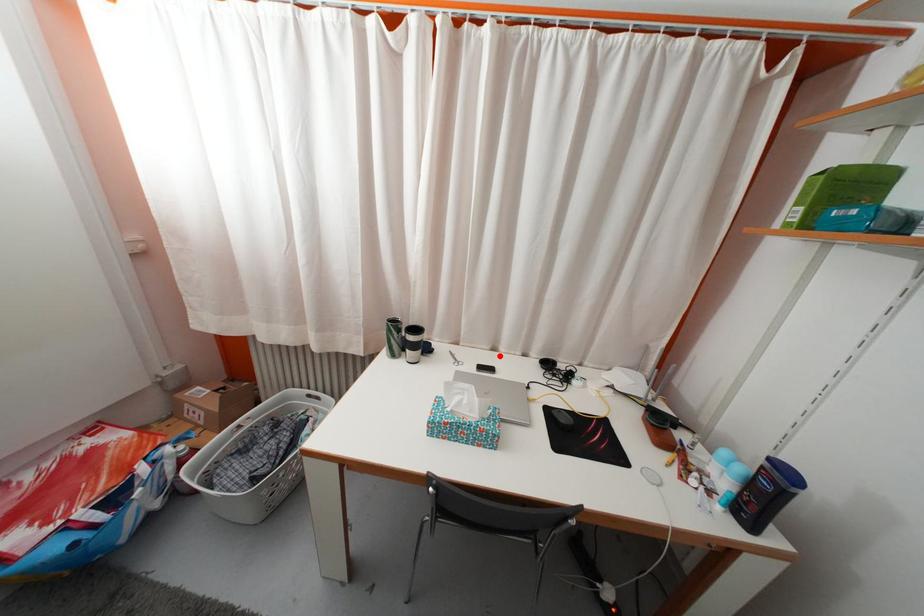
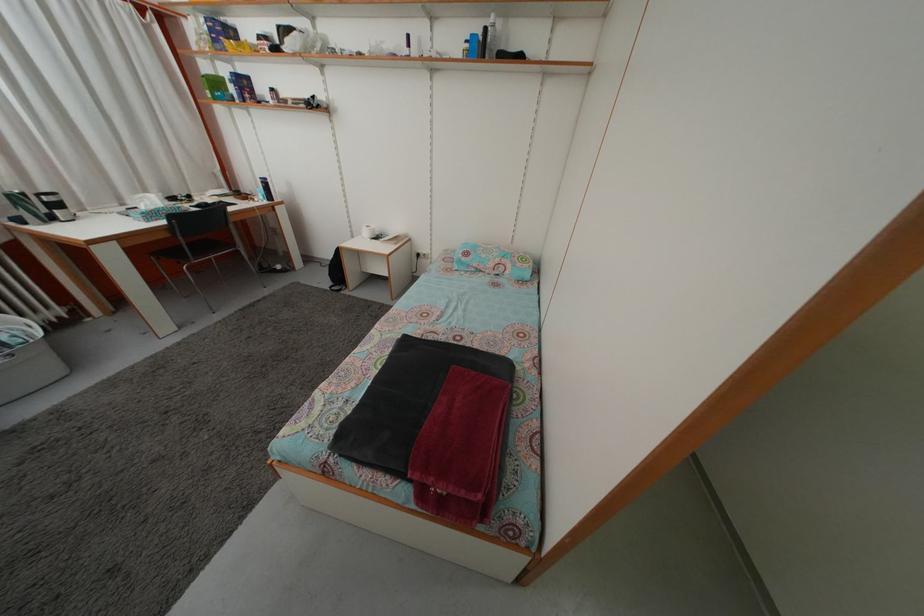
The point at the highlighted location is marked in the first image. Where is the corresponding point in the second image?

(128, 213)